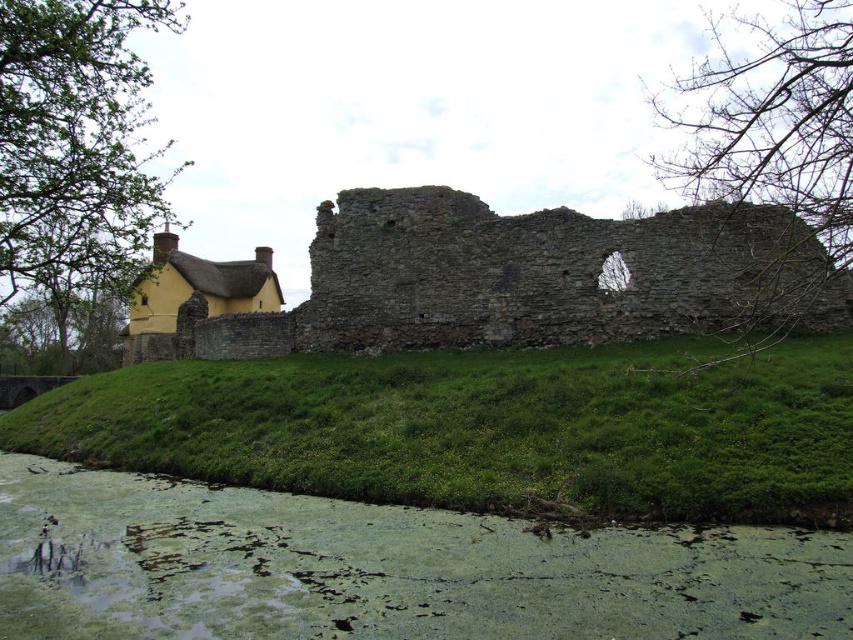
You are standing at the edge of the water and want to walk to the rustic stone wall at center. Which direction should you head to avoid the green grassy hillside at lower left?

To avoid the green grassy hillside at lower left, you should head towards the center where the rustic stone wall is located, as the hillside is on the left side and occupies less space compared to the stone wall.

You are a gardener trying to plant flowers on the green grassy hillside at lower left and the rustic stone wall at center. Which location would require a shorter ladder to reach the top?

The green grassy hillside at lower left is not as tall as rustic stone wall at center, so you would need a shorter ladder to reach the top of the green grassy hillside at lower left.

You are standing at the center of the image and want to walk towards the green grassy hillside at lower left. Which direction should you face to head directly towards it?

You should face the lower left direction to head directly towards the green grassy hillside at lower left, as its 2D location is at point (485, 428) which is positioned at the lower left of the image.